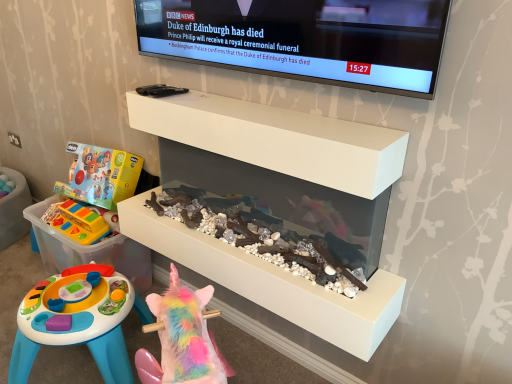
Question: Considering their positions, is black glossy tv at upper center located in front of or behind rainbow plush unicorn at lower center, which ranks as the second toy in left-to-right order?

Choices:
 (A) front
 (B) behind

Answer: (B)

Question: From a real-world perspective, relative to rainbow plush unicorn at lower center, which is the 2th toy in top-to-bottom order, is black glossy tv at upper center vertically above or below?

Choices:
 (A) above
 (B) below

Answer: (A)

Question: Considering the real-world distances, which object is farthest from the rubberized plastic toy at left, which ranks as the 2th toy in bottom-to-top order?

Choices:
 (A) white matte shelf at upper center
 (B) rainbow plush unicorn at lower center, which appears as the first toy when viewed from the right
 (C) black glossy tv at upper center
 (D) white glossy aquarium at center
 (E) translucent plastic storage box at lower left

Answer: (C)

Question: Considering the real-world distances, which object is closest to the white matte shelf at upper center?

Choices:
 (A) white glossy aquarium at center
 (B) rainbow plush unicorn at lower center, which ranks as the second toy in left-to-right order
 (C) rubberized plastic toy at left, the 2th toy when ordered from front to back
 (D) translucent plastic storage box at lower left
 (E) black glossy tv at upper center

Answer: (A)